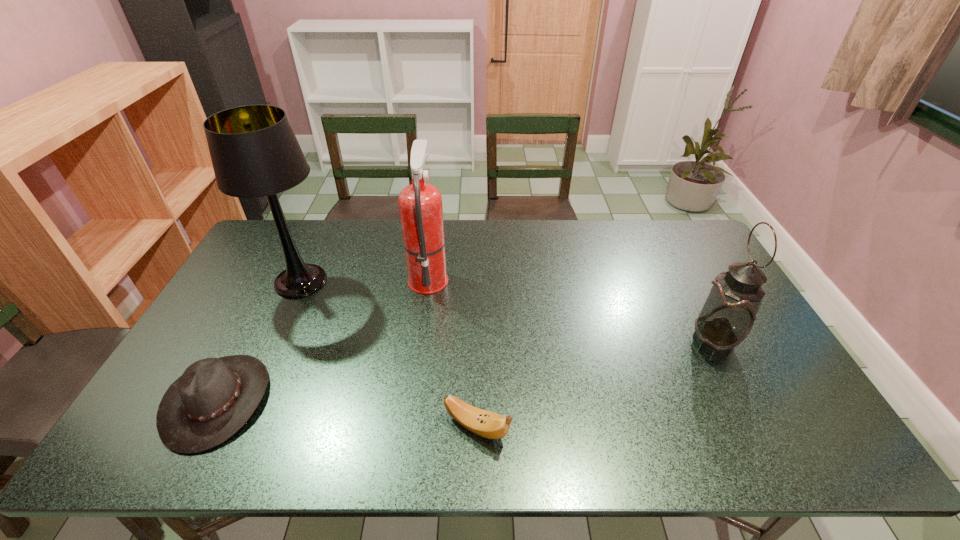
Find the location of `free space that is in between the hat and the second object from right to left`. free space that is in between the hat and the second object from right to left is located at coordinates (347, 414).

This screenshot has width=960, height=540. In order to click on vacant point located between the second object from right to left and the hat in this screenshot , I will do `click(347, 414)`.

Identify the location of free spot between the tallest object and the hat. The height and width of the screenshot is (540, 960). (259, 341).

You are a GUI agent. You are given a task and a screenshot of the screen. Output one action in this format:
    pyautogui.click(x=<x>, y=<y>)
    Task: Click on the free space between the hat and the banana
    The width and height of the screenshot is (960, 540).
    Given the screenshot: What is the action you would take?
    pyautogui.click(x=347, y=414)

Identify the location of unoccupied area between the tallest object and the second object from right to left. (389, 354).

Locate an element on the screen. The width and height of the screenshot is (960, 540). the third closest object to the table lamp is located at coordinates (484, 423).

Locate an element on the screen. object that can be found as the third closest to the banana is located at coordinates (254, 151).

At what (x,y) coordinates should I click in order to perform the action: click on free space that satisfies the following two spatial constraints: 1. on the front side of the banana; 2. on the right side of the tallest object. Please return your answer as a coordinate pair (x, y). Looking at the image, I should click on (233, 427).

Where is `free location that satisfies the following two spatial constraints: 1. on the back side of the oil lamp; 2. on the right side of the banana`? This screenshot has height=540, width=960. free location that satisfies the following two spatial constraints: 1. on the back side of the oil lamp; 2. on the right side of the banana is located at coordinates pyautogui.click(x=477, y=342).

You are a GUI agent. You are given a task and a screenshot of the screen. Output one action in this format:
    pyautogui.click(x=<x>, y=<y>)
    Task: Click on the free point that satisfies the following two spatial constraints: 1. with the handle and hose on the fourth object from left to right; 2. on the left side of the third object from left to right
    The image size is (960, 540).
    Given the screenshot: What is the action you would take?
    pyautogui.click(x=409, y=427)